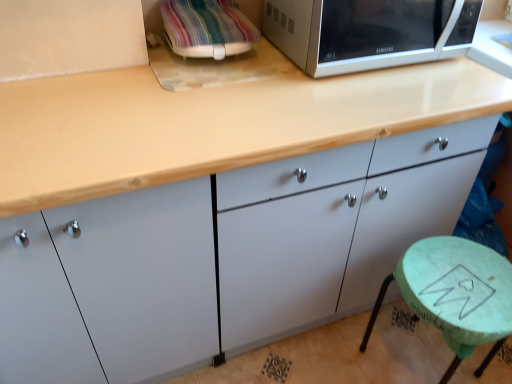
Question: From the image's perspective, is satin silver microwave at upper right above or below green marble stool at lower right?

Choices:
 (A) above
 (B) below

Answer: (A)

Question: From a real-world perspective, is satin silver microwave at upper right positioned above or below green marble stool at lower right?

Choices:
 (A) below
 (B) above

Answer: (B)

Question: Considering the real-world distances, which object is farthest from the multicolored fabric-covered microwave at upper right?

Choices:
 (A) matte white cabinet at center
 (B) green marble stool at lower right
 (C) satin silver microwave at upper right

Answer: (B)

Question: Which object is positioned closest to the multicolored fabric-covered microwave at upper right?

Choices:
 (A) matte white cabinet at center
 (B) satin silver microwave at upper right
 (C) green marble stool at lower right

Answer: (B)